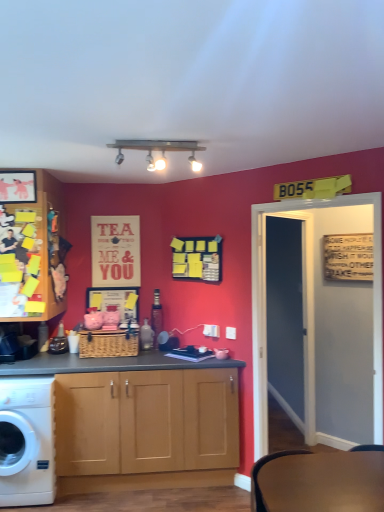
Locate an element on the screen. The height and width of the screenshot is (512, 384). vacant space situated above brown wooden table at lower right (from a real-world perspective) is located at coordinates (307, 468).